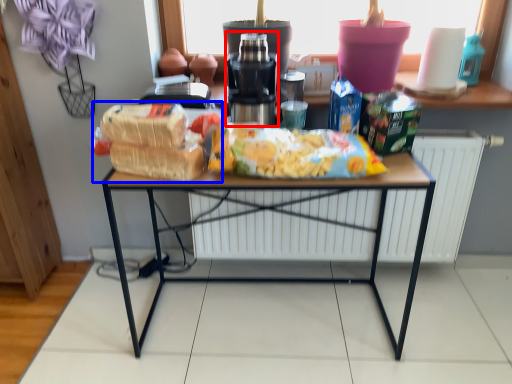
Question: Which object is closer to the camera taking this photo, coffee machine (highlighted by a red box) or snack (highlighted by a blue box)?

Choices:
 (A) coffee machine
 (B) snack

Answer: (B)